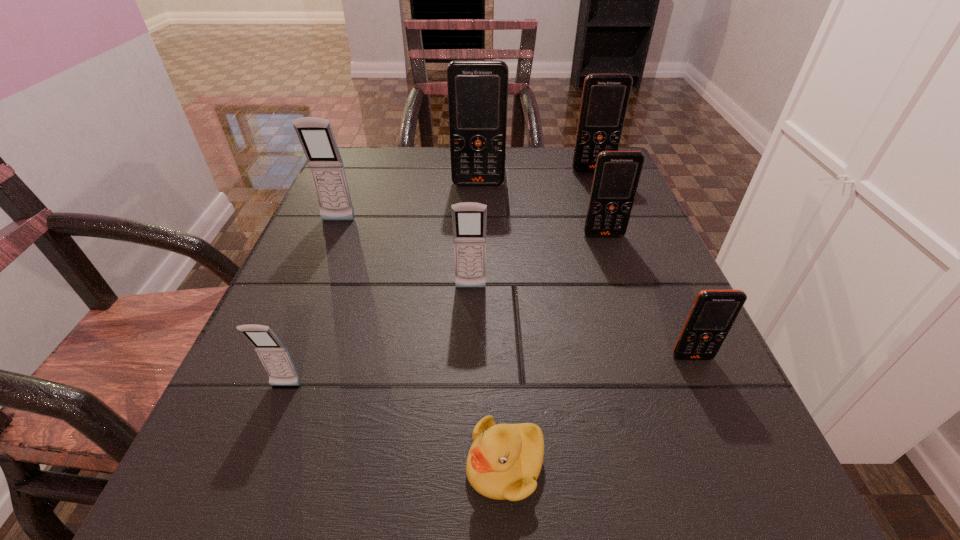
The width and height of the screenshot is (960, 540). In order to click on the second nearest cellular telephone in this screenshot , I will do `click(713, 312)`.

Find the location of a particular element. the smallest orange cellular telephone is located at coordinates (713, 312).

Where is `the nearest gray cellular telephone`? The height and width of the screenshot is (540, 960). the nearest gray cellular telephone is located at coordinates (273, 354).

I want to click on the nearest cellular telephone, so tap(273, 354).

I want to click on the nearest object, so click(504, 461).

Where is `the shortest object`? the shortest object is located at coordinates (504, 461).

Identify the location of free spot located 0.070m on the screen of the biggest orange cellular telephone. (478, 204).

The height and width of the screenshot is (540, 960). I want to click on vacant space situated 0.130m on the front-facing side of the biggest gray cellular telephone, so click(x=320, y=267).

Find the location of a particular element. vacant space located on the screen of the farthest orange cellular telephone is located at coordinates (610, 215).

Where is `free point located 0.210m on the front-facing side of the second farthest gray cellular telephone`? This screenshot has height=540, width=960. free point located 0.210m on the front-facing side of the second farthest gray cellular telephone is located at coordinates pyautogui.click(x=468, y=401).